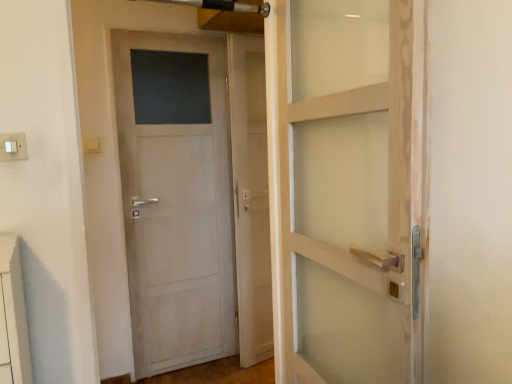
Where is `transparent glass screen door at center`? transparent glass screen door at center is located at coordinates (250, 196).

Find the location of a particular element. Image resolution: width=512 pixels, height=384 pixels. white wood door at left is located at coordinates (175, 197).

Find the location of a particular element. transparent glass screen door at center is located at coordinates (250, 196).

Based on the photo, is white plastic switch at upper left far away from white wood door at left?

Indeed, white plastic switch at upper left is not near white wood door at left.

Does white plastic switch at upper left contain white wood door at left?

No.

From a real-world perspective, which object stands above the other?

In real-world perspective, white plastic switch at upper left is above.

From a real-world perspective, is white wood door at left on white plastic switch at upper left?

No.

From the picture: Does white wood door at left turn towards white plastic switch at upper left?

No, white wood door at left is not turned towards white plastic switch at upper left.

Locate an element on the screen. door directly beneath the white plastic switch at upper left (from a real-world perspective) is located at coordinates (175, 197).

From the image's perspective, who appears lower, white wood door at left or white plastic switch at upper left?

white wood door at left appears lower in the image.

What are the coordinates of `door lying above the transparent glass screen door at center (from the image's perspective)` in the screenshot? It's located at [175, 197].

In the image, is white wood door at left positioned in front of or behind transparent glass screen door at center?

Visually, white wood door at left is located in front of transparent glass screen door at center.

Could transparent glass screen door at center be considered to be inside white wood door at left?

No, transparent glass screen door at center is not inside white wood door at left.

Which is in front, point (140, 299) or point (254, 59)?

The point (254, 59) is closer to the camera.

Which of these two, white plastic switch at upper left or transparent glass screen door at center, is wider?

transparent glass screen door at center.

Does white plastic switch at upper left touch transparent glass screen door at center?

No, white plastic switch at upper left is not touching transparent glass screen door at center.

Looking at this image, from a real-world perspective, which object stands above the other?

From a 3D spatial view, white plastic switch at upper left is above.

Which object is closer to the camera taking this photo, white plastic switch at upper left or transparent glass screen door at center?

white plastic switch at upper left is closer to the camera.

Who is taller, transparent glass screen door at center or white plastic switch at upper left?

Standing taller between the two is transparent glass screen door at center.

Between transparent glass screen door at center and white plastic switch at upper left, which one has larger width?

transparent glass screen door at center is wider.

Can you see transparent glass screen door at center touching white plastic switch at upper left?

No, transparent glass screen door at center is not next to white plastic switch at upper left.

From a real-world perspective, is transparent glass screen door at center on top of white wood door at left?

No, from a real-world perspective, transparent glass screen door at center is not over white wood door at left

At what (x,y) coordinates should I click in order to perform the action: click on door that is on the left side of transparent glass screen door at center. Please return your answer as a coordinate pair (x, y). Looking at the image, I should click on [x=175, y=197].

Can you confirm if transparent glass screen door at center is shorter than white wood door at left?

In fact, transparent glass screen door at center may be taller than white wood door at left.

Is transparent glass screen door at center facing away from white wood door at left?

transparent glass screen door at center does not have its back to white wood door at left.

At what (x,y) coordinates should I click in order to perform the action: click on door below the white plastic switch at upper left (from the image's perspective). Please return your answer as a coordinate pair (x, y). The image size is (512, 384). Looking at the image, I should click on (175, 197).

Identify the location of electric outlet that appears above the white wood door at left (from the image's perspective). (13, 147).

Looking at the image, which one is located closer to white plastic switch at upper left, transparent glass screen door at center or white wood door at left?

Among the two, white wood door at left is located nearer to white plastic switch at upper left.

From the picture: Looking at the image, which one is located closer to white wood door at left, white plastic switch at upper left or transparent glass screen door at center?

transparent glass screen door at center.

Estimate the real-world distances between objects in this image. Which object is further from white plastic switch at upper left, white wood door at left or transparent glass screen door at center?

Based on the image, transparent glass screen door at center appears to be further to white plastic switch at upper left.

Estimate the real-world distances between objects in this image. Which object is closer to transparent glass screen door at center, white wood door at left or white plastic switch at upper left?

white wood door at left.

Based on their spatial positions, is transparent glass screen door at center or white plastic switch at upper left closer to white wood door at left?

transparent glass screen door at center lies closer to white wood door at left than the other object.

Looking at the image, which one is located closer to transparent glass screen door at center, white plastic switch at upper left or white wood door at left?

Based on the image, white wood door at left appears to be nearer to transparent glass screen door at center.

You are a GUI agent. You are given a task and a screenshot of the screen. Output one action in this format:
    pyautogui.click(x=<x>, y=<y>)
    Task: Click on the door located between white plastic switch at upper left and transparent glass screen door at center in the depth direction
    Image resolution: width=512 pixels, height=384 pixels.
    Given the screenshot: What is the action you would take?
    pyautogui.click(x=175, y=197)